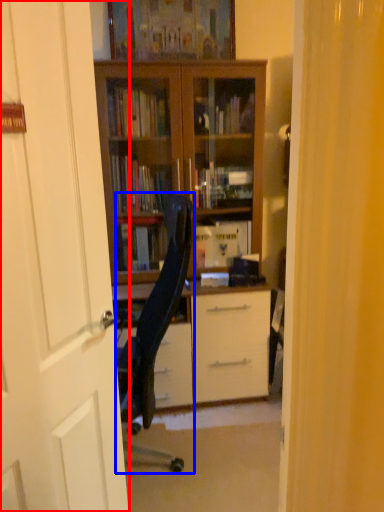
Question: Which object is further to the camera taking this photo, door (highlighted by a red box) or chair (highlighted by a blue box)?

Choices:
 (A) door
 (B) chair

Answer: (B)